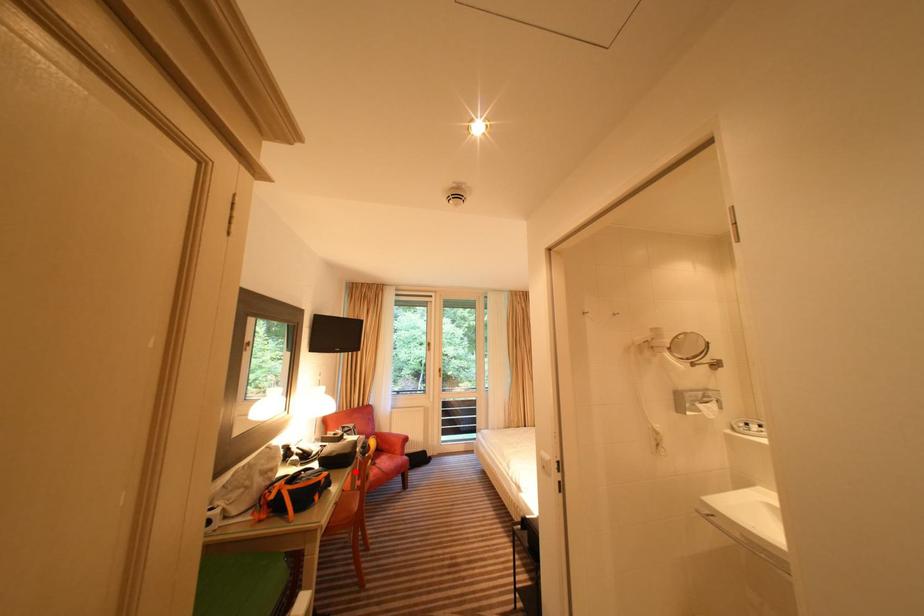
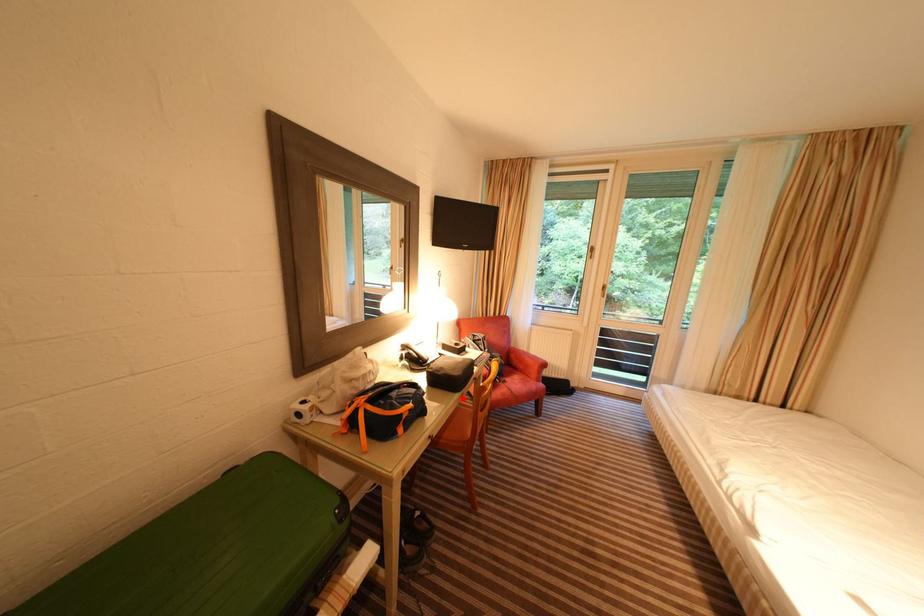
I am providing you with two images of the same scene from different viewpoints. A red point is marked on the first image and another point is marked on the second image. Is the marked point in image1 the same physical position as the marked point in image2?

Yes